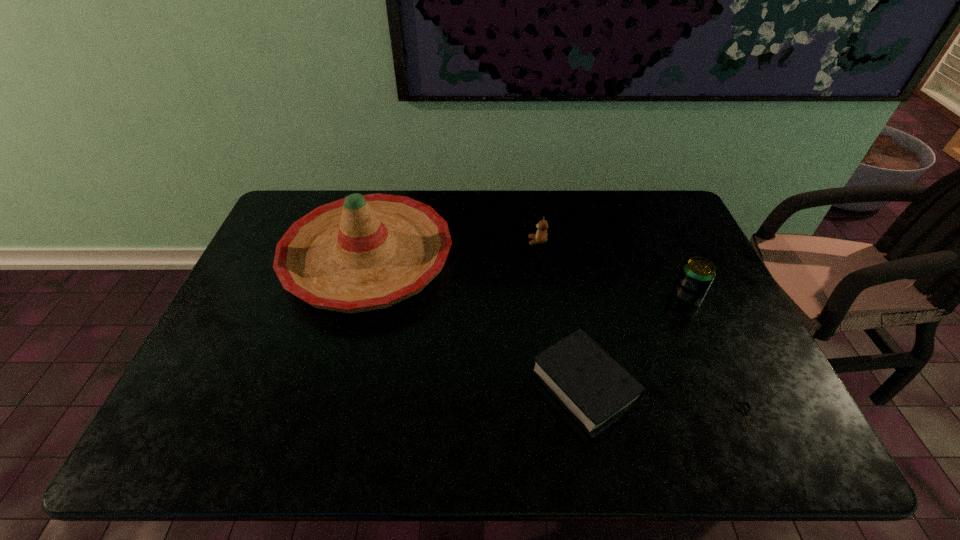
In order to click on the tallest object in this screenshot , I will do `click(361, 253)`.

This screenshot has height=540, width=960. I want to click on sombrero, so click(361, 253).

You are a GUI agent. You are given a task and a screenshot of the screen. Output one action in this format:
    pyautogui.click(x=<x>, y=<y>)
    Task: Click on the beer can
    
    Given the screenshot: What is the action you would take?
    pyautogui.click(x=697, y=273)

What are the coordinates of `teddy bear` in the screenshot? It's located at [x=540, y=237].

This screenshot has height=540, width=960. Identify the location of Bible. coord(593,387).

Locate an element on the screen. The width and height of the screenshot is (960, 540). shears is located at coordinates (745, 411).

Locate an element on the screen. The width and height of the screenshot is (960, 540). free space located on the right of the sombrero is located at coordinates (472, 259).

You are a GUI agent. You are given a task and a screenshot of the screen. Output one action in this format:
    pyautogui.click(x=<x>, y=<y>)
    Task: Click on the vacant space situated on the front of the fourth shortest object
    This screenshot has height=540, width=960.
    Given the screenshot: What is the action you would take?
    pyautogui.click(x=704, y=339)

Find the location of a particular element. This screenshot has width=960, height=540. free space located 0.240m on the front-facing side of the teddy bear is located at coordinates (453, 241).

Where is `vacant space located 0.250m on the front-facing side of the teddy bear`? vacant space located 0.250m on the front-facing side of the teddy bear is located at coordinates (450, 241).